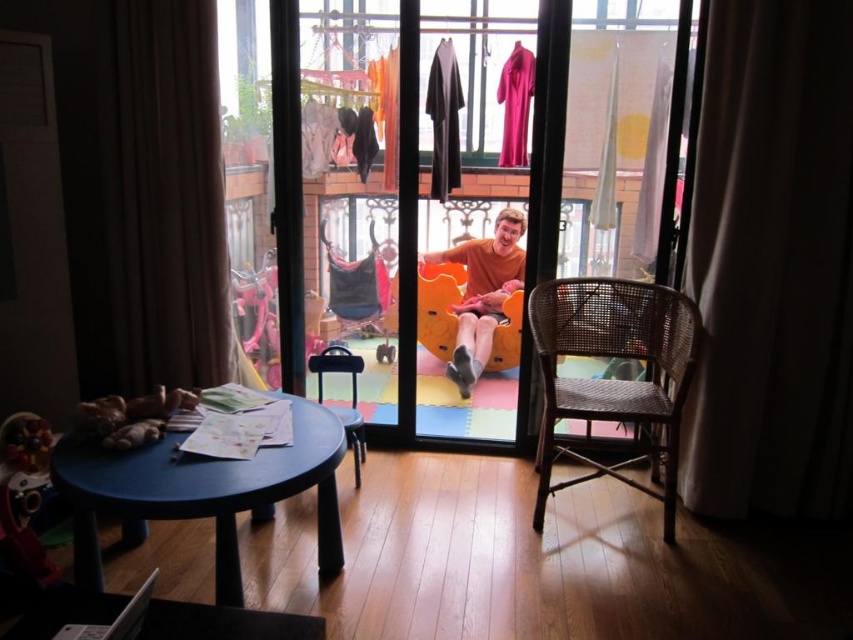
Question: From the image, what is the correct spatial relationship of white fabric curtain at right in relation to blue plastic table at lower left?

Choices:
 (A) right
 (B) left

Answer: (A)

Question: Which point appears closest to the camera in this image?

Choices:
 (A) (492, 284)
 (B) (334, 348)
 (C) (115, 404)
 (D) (135, 456)

Answer: (D)

Question: Which object appears closest to the camera in this image?

Choices:
 (A) blue plastic table at lower left
 (B) brown fabric curtain at left
 (C) woven brown chair at right
 (D) brown cotton shirt at center

Answer: (A)

Question: Is woven brown chair at right smaller than matte black chair at center?

Choices:
 (A) yes
 (B) no

Answer: (B)

Question: Is transparent plastic glass door at center wider than matte black chair at center?

Choices:
 (A) no
 (B) yes

Answer: (B)

Question: Which point is closer to the camera?

Choices:
 (A) transparent plastic glass door at center
 (B) soft plush toys at lower left
 (C) woven brown chair at right

Answer: (B)